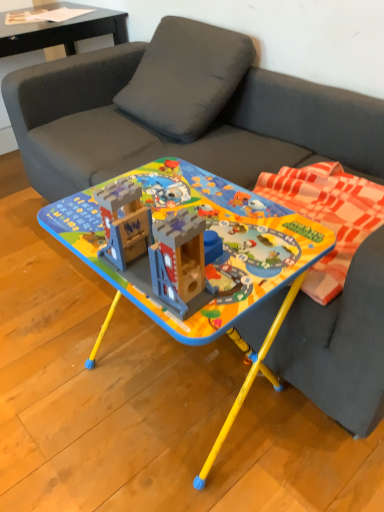
Question: Considering the relative positions of black glossy side table at upper left and plaid fabric blanket at right in the image provided, is black glossy side table at upper left to the left of plaid fabric blanket at right from the viewer's perspective?

Choices:
 (A) no
 (B) yes

Answer: (B)

Question: Is plaid fabric blanket at right surrounded by black glossy side table at upper left?

Choices:
 (A) yes
 (B) no

Answer: (B)

Question: Does black glossy side table at upper left touch plaid fabric blanket at right?

Choices:
 (A) yes
 (B) no

Answer: (B)

Question: From the image's perspective, is black glossy side table at upper left over plaid fabric blanket at right?

Choices:
 (A) no
 (B) yes

Answer: (B)

Question: Is black glossy side table at upper left positioned with its back to plaid fabric blanket at right?

Choices:
 (A) yes
 (B) no

Answer: (B)

Question: From a real-world perspective, is black glossy side table at upper left on plaid fabric blanket at right?

Choices:
 (A) no
 (B) yes

Answer: (A)

Question: Does black glossy side table at upper left appear on the left side of matte black paper at upper left, the first table in the left-to-right sequence?

Choices:
 (A) no
 (B) yes

Answer: (B)

Question: Does black glossy side table at upper left have a lesser width compared to matte black paper at upper left, placed as the 1th table when sorted from top to bottom?

Choices:
 (A) no
 (B) yes

Answer: (A)

Question: Would you say black glossy side table at upper left is outside matte black paper at upper left, arranged as the first table when viewed from the back?

Choices:
 (A) yes
 (B) no

Answer: (A)

Question: Considering the relative sizes of black glossy side table at upper left and matte black paper at upper left, which is the 2th table in front-to-back order, in the image provided, is black glossy side table at upper left taller than matte black paper at upper left, which is the 2th table in front-to-back order,?

Choices:
 (A) no
 (B) yes

Answer: (B)

Question: Can you confirm if black glossy side table at upper left is wider than matte black paper at upper left, placed as the 1th table when sorted from top to bottom?

Choices:
 (A) yes
 (B) no

Answer: (A)

Question: Is black glossy side table at upper left next to matte black paper at upper left, placed as the 1th table when sorted from top to bottom, and touching it?

Choices:
 (A) yes
 (B) no

Answer: (A)

Question: Is matte plastic table at center, the 1th table when ordered from right to left, thinner than matte black paper at upper left, acting as the 2th table starting from the bottom?

Choices:
 (A) yes
 (B) no

Answer: (B)